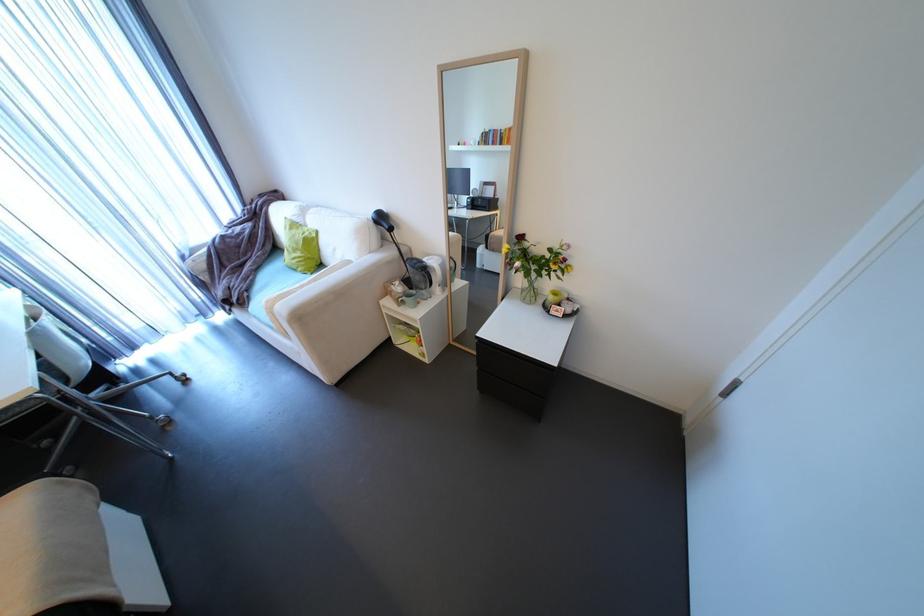
This screenshot has height=616, width=924. Identify the location of green mug. (409, 299).